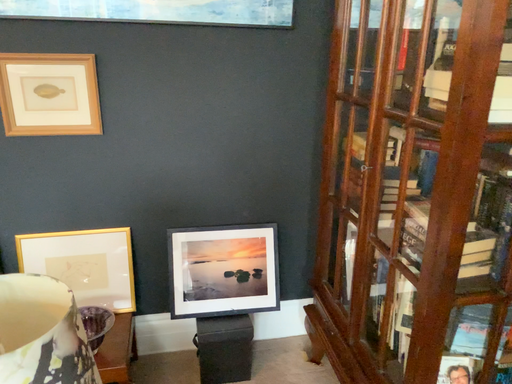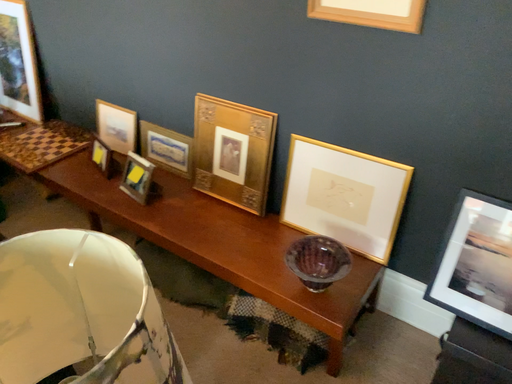
Question: Which way did the camera rotate in the video?

Choices:
 (A) rotated left
 (B) rotated right

Answer: (A)